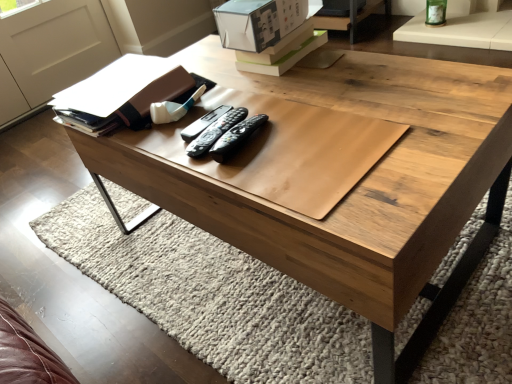
Question: From a real-world perspective, is white cardboard box at upper center under black plastic remote at center, acting as the 1th remote starting from the right?

Choices:
 (A) no
 (B) yes

Answer: (A)

Question: Is white cardboard box at upper center thinner than black plastic remote at center, acting as the 1th remote starting from the right?

Choices:
 (A) no
 (B) yes

Answer: (A)

Question: Is white cardboard box at upper center in contact with black plastic remote at center, acting as the 1th remote starting from the right?

Choices:
 (A) no
 (B) yes

Answer: (A)

Question: From a real-world perspective, is white cardboard box at upper center positioned over black plastic remote at center, the 3th remote when ordered from left to right, based on gravity?

Choices:
 (A) no
 (B) yes

Answer: (B)

Question: Considering the relative positions of white cardboard box at upper center and black plastic remote at center, the 3th remote when ordered from left to right, in the image provided, is white cardboard box at upper center to the right of black plastic remote at center, the 3th remote when ordered from left to right, from the viewer's perspective?

Choices:
 (A) no
 (B) yes

Answer: (B)

Question: Is matte brown book at upper left wider or thinner than white cardboard box at upper center?

Choices:
 (A) wide
 (B) thin

Answer: (A)

Question: From a real-world perspective, relative to white cardboard box at upper center, is matte brown book at upper left vertically above or below?

Choices:
 (A) below
 (B) above

Answer: (A)

Question: From the image's perspective, is matte brown book at upper left positioned above or below white cardboard box at upper center?

Choices:
 (A) above
 (B) below

Answer: (B)

Question: Based on their sizes in the image, would you say matte brown book at upper left is bigger or smaller than white cardboard box at upper center?

Choices:
 (A) small
 (B) big

Answer: (B)

Question: Is point (233, 122) positioned closer to the camera than point (183, 81)?

Choices:
 (A) closer
 (B) farther

Answer: (A)

Question: From the image's perspective, relative to matte brown book at upper left, is black plastic remote at center, marked as the 2th remote in a right-to-left arrangement, above or below?

Choices:
 (A) below
 (B) above

Answer: (A)

Question: Looking at the image, does black plastic remote at center, which ranks as the 2th remote in left-to-right order, seem bigger or smaller compared to matte brown book at upper left?

Choices:
 (A) small
 (B) big

Answer: (A)

Question: From a real-world perspective, is black plastic remote at center, marked as the 2th remote in a right-to-left arrangement, positioned above or below matte brown book at upper left?

Choices:
 (A) below
 (B) above

Answer: (A)

Question: Looking at their shapes, would you say black plastic remote at center, which ranks as the 2th remote in left-to-right order, is wider or thinner than black plastic remote at center, marked as the 1th remote in a left-to-right arrangement?

Choices:
 (A) thin
 (B) wide

Answer: (B)

Question: Based on their positions, is black plastic remote at center, marked as the 2th remote in a right-to-left arrangement, located to the left or right of black plastic remote at center, marked as the 1th remote in a left-to-right arrangement?

Choices:
 (A) right
 (B) left

Answer: (A)